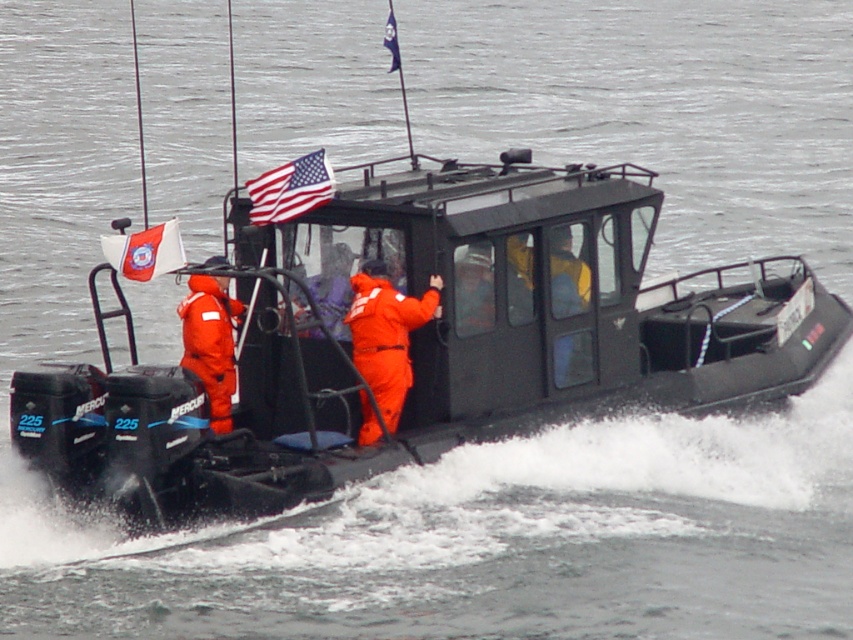
Question: Which object is closer to the camera taking this photo?

Choices:
 (A) american flag at upper center
 (B) white fabric flag at upper left
 (C) orange fabric suit at center
 (D) blue fabric flag at upper center

Answer: (B)

Question: Is american flag at upper center thinner than white fabric flag at upper left?

Choices:
 (A) no
 (B) yes

Answer: (B)

Question: Which is nearer to the white fabric flag at upper left?

Choices:
 (A) orange smooth suit at center
 (B) american flag at upper center
 (C) orange fabric suit at center
 (D) blue fabric flag at upper center

Answer: (A)

Question: Is american flag at upper center above blue fabric flag at upper center?

Choices:
 (A) no
 (B) yes

Answer: (A)

Question: In this image, where is orange smooth suit at center located relative to american flag at upper center?

Choices:
 (A) right
 (B) left

Answer: (B)

Question: Among these points, which one is nearest to the camera?

Choices:
 (A) (390, 51)
 (B) (364, 332)

Answer: (B)